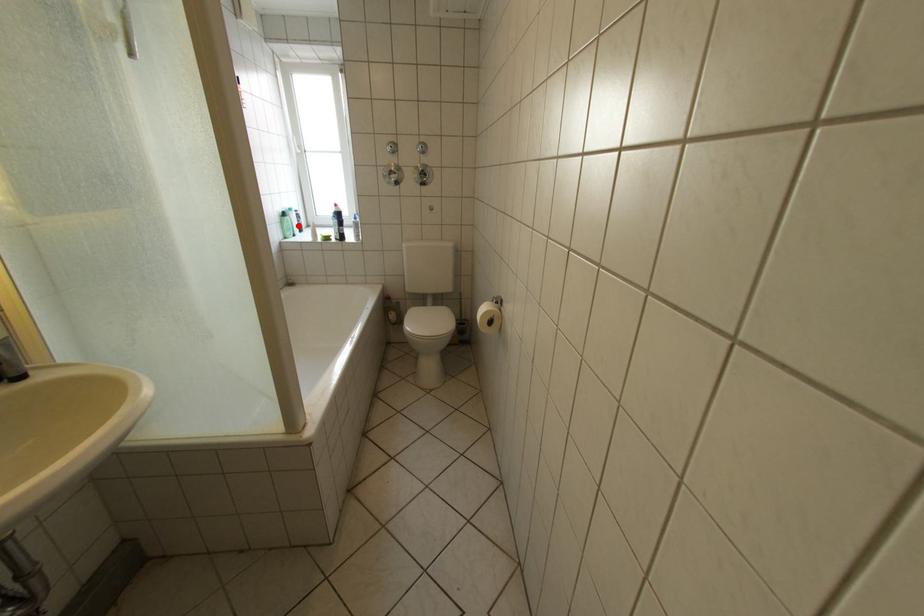
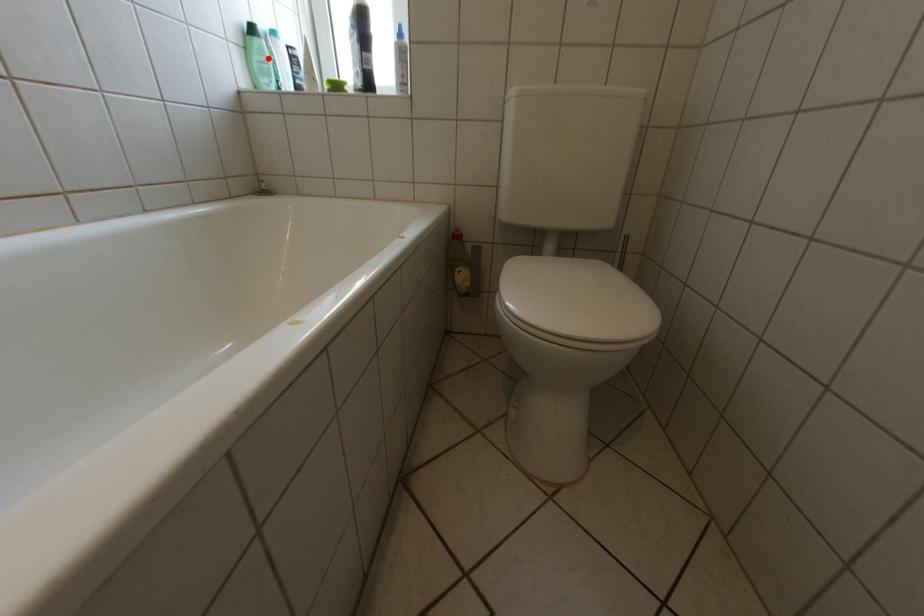
I am providing you with two images of the same scene from different viewpoints. A red point is marked on the first image and another point is marked on the second image. Does the point marked in image1 correspond to the same location as the one in image2?

Yes